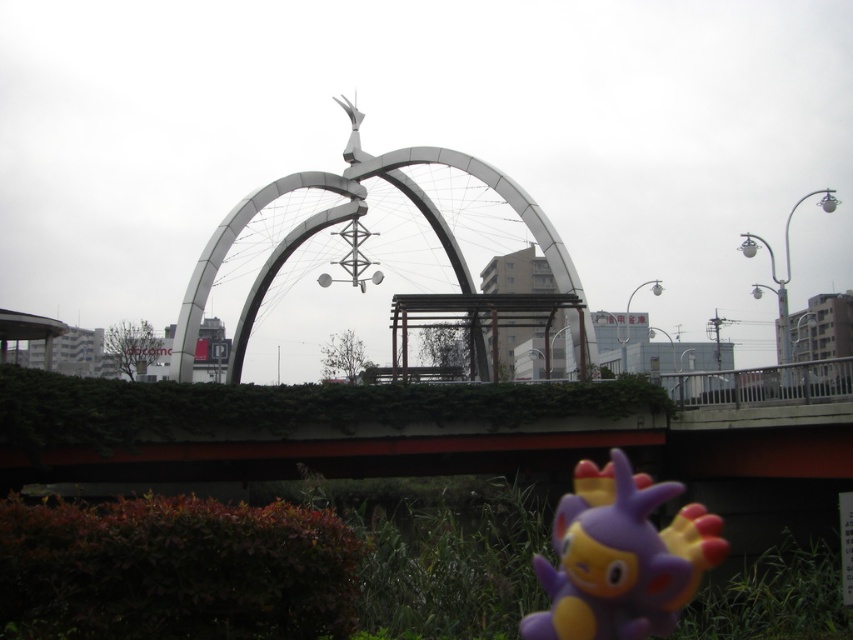
Which is behind, point (680, 554) or point (229, 236)?

Positioned behind is point (229, 236).

In the scene shown: Is purple matte toy at lower center to the left of metallic silver archway at center from the viewer's perspective?

Incorrect, purple matte toy at lower center is not on the left side of metallic silver archway at center.

Which is behind, point (664, 604) or point (436, 225)?

The point (436, 225) is behind.

Find the location of a particular element. This screenshot has width=853, height=640. purple matte toy at lower center is located at coordinates (619, 557).

Is point (526, 417) farther from viewer compared to point (561, 564)?

Yes, point (526, 417) is behind point (561, 564).

Does green ivy-covered bridge at center have a lesser width compared to purple matte toy at lower center?

In fact, green ivy-covered bridge at center might be wider than purple matte toy at lower center.

Between point (488, 422) and point (596, 616), which one is positioned behind?

The point (488, 422) is behind.

This screenshot has width=853, height=640. I want to click on green ivy-covered bridge at center, so click(392, 429).

Is green ivy-covered bridge at center further to camera compared to metallic silver archway at center?

No, green ivy-covered bridge at center is in front of metallic silver archway at center.

Can you confirm if green ivy-covered bridge at center is positioned below metallic silver archway at center?

Yes, green ivy-covered bridge at center is below metallic silver archway at center.

In order to click on green ivy-covered bridge at center in this screenshot , I will do `click(392, 429)`.